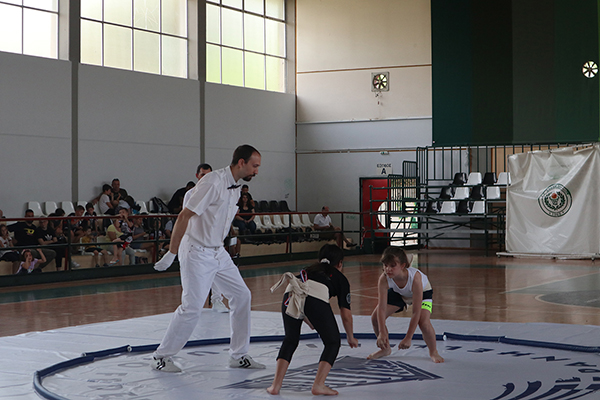
Locate an element on the screen. floor is located at coordinates (123, 382).